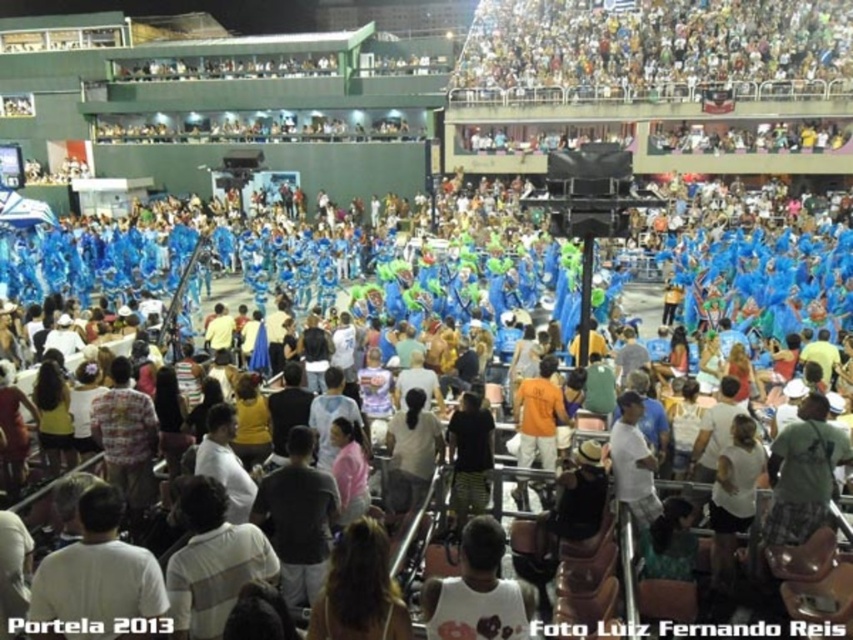
Does point (543, 36) come behind point (524, 381)?

Yes.

Which is behind, point (622, 86) or point (517, 396)?

Point (622, 86)

The height and width of the screenshot is (640, 853). What are the coordinates of `multicolored fabric crowd at upper center` in the screenshot? It's located at (653, 49).

Who is higher up, white cotton tank top at center or orange cotton shirt at center?

orange cotton shirt at center is higher up.

Does white cotton tank top at center have a lesser height compared to orange cotton shirt at center?

No, white cotton tank top at center is not shorter than orange cotton shirt at center.

Does point (434, 580) lie behind point (537, 412)?

No.

What are the coordinates of `white cotton tank top at center` in the screenshot? It's located at [x=479, y=592].

Which of these two, multicolored fabric crowd at upper center or white cotton tank top at center, stands shorter?

Standing shorter between the two is white cotton tank top at center.

Does multicolored fabric crowd at upper center have a lesser height compared to white cotton tank top at center?

No.

At what (x,y) coordinates should I click in order to perform the action: click on multicolored fabric crowd at upper center. Please return your answer as a coordinate pair (x, y). Looking at the image, I should click on pyautogui.click(x=653, y=49).